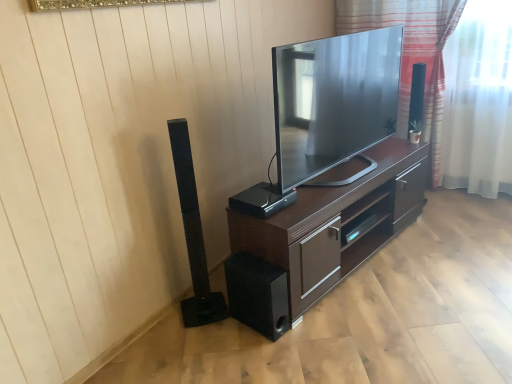
Identify the location of free space in front of black matte speaker at left, the third speaker from the right. (207, 336).